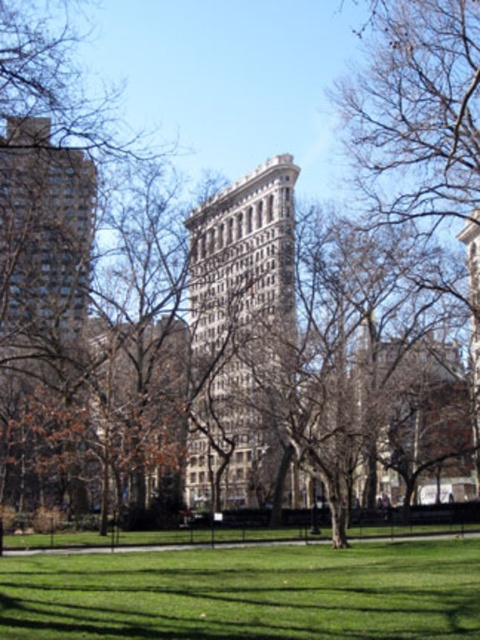
Question: Which object is farther from the camera taking this photo?

Choices:
 (A) green grass at center
 (B) white stone tower at center
 (C) white stone building at center

Answer: (C)

Question: Which object is farther from the camera taking this photo?

Choices:
 (A) matte glass building at left
 (B) green grass at center
 (C) white stone building at center
 (D) brown leafless tree at left

Answer: (C)

Question: Is white stone building at center below matte glass building at left?

Choices:
 (A) no
 (B) yes

Answer: (B)

Question: Can you confirm if brown leafless tree at left is positioned below white stone building at center?

Choices:
 (A) yes
 (B) no

Answer: (B)

Question: Estimate the real-world distances between objects in this image. Which object is closer to the white stone building at center?

Choices:
 (A) matte glass building at left
 (B) green grass at center
 (C) brown leafless tree at left

Answer: (C)

Question: Is white stone building at center above white stone tower at center?

Choices:
 (A) yes
 (B) no

Answer: (A)